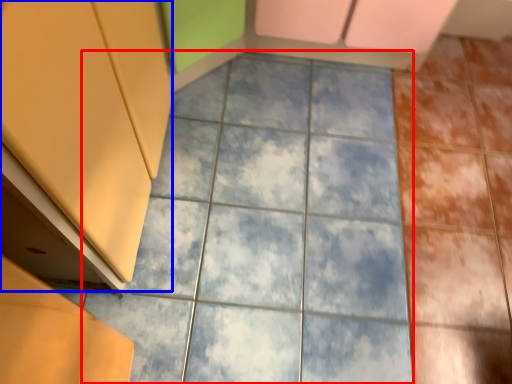
Question: Which of the following is the closest to the observer, ceramic tile (highlighted by a red box) or cabinetry (highlighted by a blue box)?

Choices:
 (A) ceramic tile
 (B) cabinetry

Answer: (B)